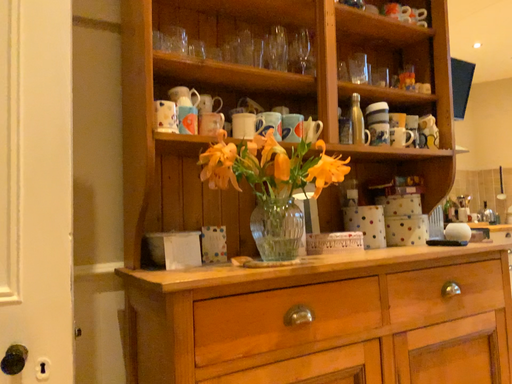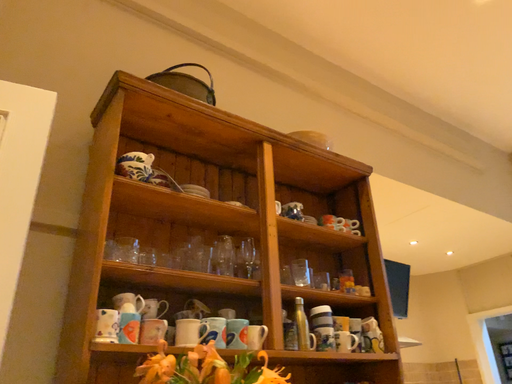
Question: How did the camera likely rotate when shooting the video?

Choices:
 (A) rotated downward
 (B) rotated upward

Answer: (B)